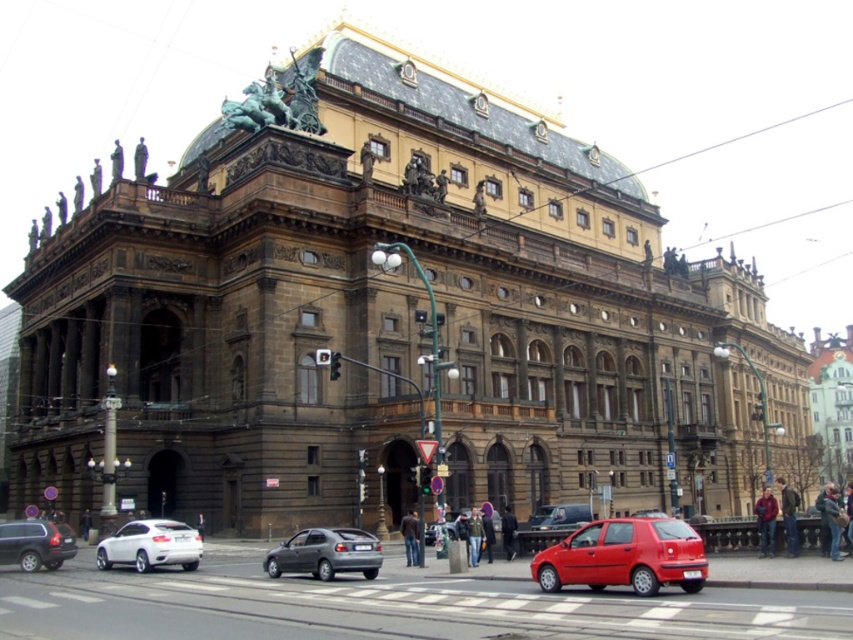
You are a pedestrian standing at the intersection near the jeans at center. You want to cross the street to reach the sidewalk on the other side. Is the metallic gray hatchback at lower left blocking your path?

The metallic gray hatchback at lower left is to the left of jeans at center, so it is positioned away from your current location. Therefore, it is not blocking your path to cross the street to the sidewalk on the other side.

You are a pedestrian standing at the intersection and see a red leather jacket at center and jeans at center. You want to pick up both items and return them to their owners. Which item is farther from you?

The red leather jacket at center is 18.17 meters away from the jeans at center. Since you are at the intersection, the distance between them is 18.17 meters, so whichever is farther depends on your exact position. However, the question states to determine which is farther from you, but without knowing your position relative to both items, we cannot determine which is farther. The given information only specifies the distance between the two items, not their positions relative to the pedestrian.

You are a pedestrian standing on the sidewalk near the grand building. You see two jackets hanging on a rack between you and the road. Which jacket is closer to the road, the brown leather jacket at center or the khaki fabric jacket at center?

The khaki fabric jacket at center is closer to the road because the brown leather jacket at center is positioned on the left side of it, meaning the khaki fabric jacket is further to the right towards the road.